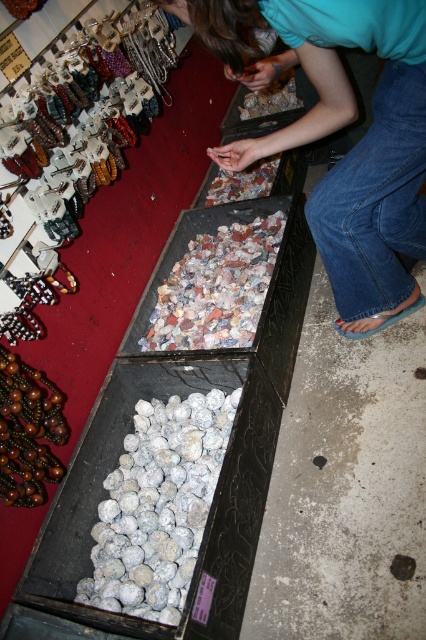
You are a customer in the shop looking for beads to buy. You see wooden beads at left and brown wooden beads at lower left. Which one is positioned to the right side?

The wooden beads at left are positioned to the right of the brown wooden beads at lower left.

You are standing in the shop and want to pick up an item located at point (115, 106) and another item at point (43, 449). Which item will you reach first if you move towards them?

You will reach the item at point (115, 106) first because it is closer to you than the item at point (43, 449), which is further away.